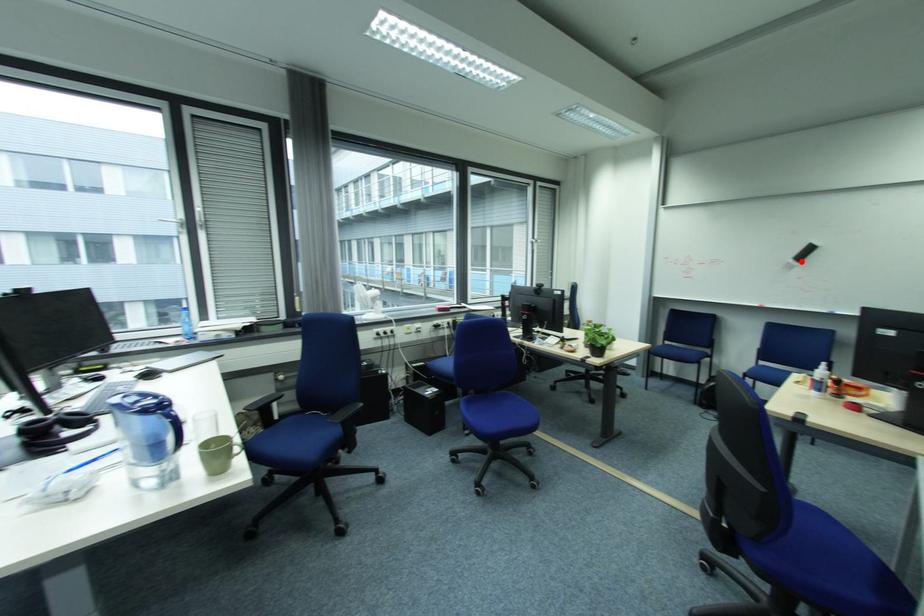
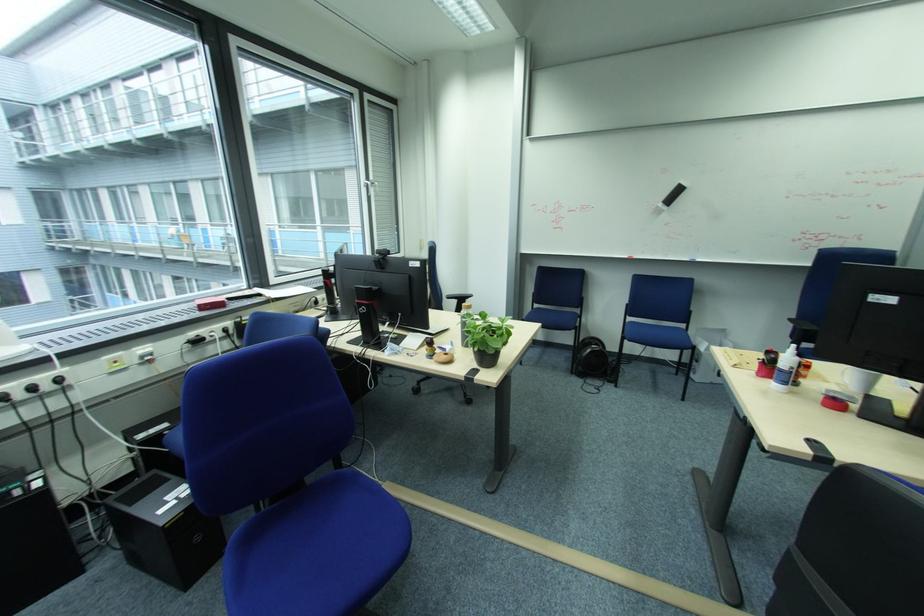
Where in the second image is the point corresponding to the highlighted location from the first image?

(669, 206)